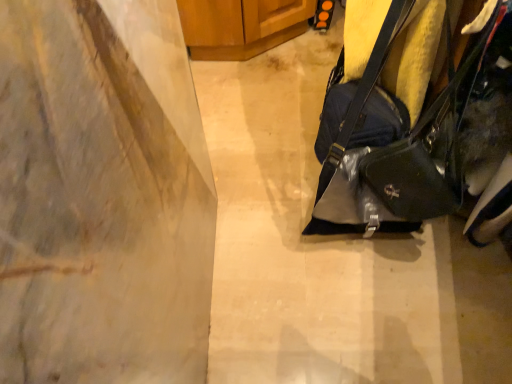
Question: From a real-world perspective, is matte gray concrete at center on glossy black handbag at right?

Choices:
 (A) yes
 (B) no

Answer: (B)

Question: Considering the relative sizes of matte gray concrete at center and glossy black handbag at right in the image provided, is matte gray concrete at center bigger than glossy black handbag at right?

Choices:
 (A) yes
 (B) no

Answer: (B)

Question: Could you tell me if matte gray concrete at center is facing glossy black handbag at right?

Choices:
 (A) no
 (B) yes

Answer: (A)

Question: Is matte gray concrete at center taller than glossy black handbag at right?

Choices:
 (A) no
 (B) yes

Answer: (A)

Question: Can glossy black handbag at right be found inside matte gray concrete at center?

Choices:
 (A) no
 (B) yes

Answer: (A)

Question: Considering their positions, is wooden cabinet at upper center located in front of or behind glossy black handbag at right?

Choices:
 (A) front
 (B) behind

Answer: (B)

Question: Is wooden cabinet at upper center wider or thinner than glossy black handbag at right?

Choices:
 (A) thin
 (B) wide

Answer: (B)

Question: From a real-world perspective, is wooden cabinet at upper center physically located above or below glossy black handbag at right?

Choices:
 (A) above
 (B) below

Answer: (B)

Question: Is wooden cabinet at upper center inside or outside of glossy black handbag at right?

Choices:
 (A) outside
 (B) inside

Answer: (A)

Question: From the image's perspective, relative to wooden cabinet at upper center, is glossy black handbag at right above or below?

Choices:
 (A) below
 (B) above

Answer: (A)

Question: From a real-world perspective, is glossy black handbag at right positioned above or below wooden cabinet at upper center?

Choices:
 (A) below
 (B) above

Answer: (B)

Question: Choose the correct answer: Is glossy black handbag at right inside wooden cabinet at upper center or outside it?

Choices:
 (A) outside
 (B) inside

Answer: (A)

Question: Is glossy black handbag at right bigger or smaller than wooden cabinet at upper center?

Choices:
 (A) small
 (B) big

Answer: (A)

Question: Is glossy black handbag at right taller or shorter than matte gray concrete at center?

Choices:
 (A) tall
 (B) short

Answer: (A)

Question: Looking at their shapes, would you say glossy black handbag at right is wider or thinner than matte gray concrete at center?

Choices:
 (A) wide
 (B) thin

Answer: (B)